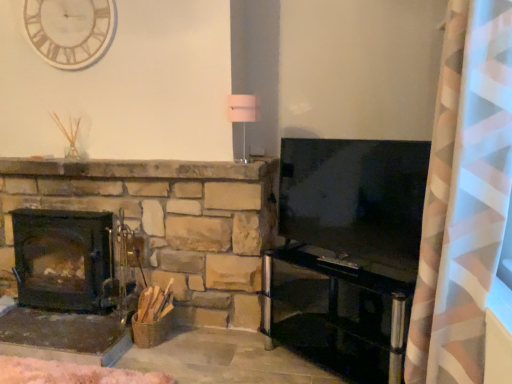
Question: Can you confirm if white wooden clock at upper left is wider than transparent glass entertainment center at lower right?

Choices:
 (A) no
 (B) yes

Answer: (A)

Question: Is white wooden clock at upper left outside transparent glass entertainment center at lower right?

Choices:
 (A) no
 (B) yes

Answer: (B)

Question: Is white wooden clock at upper left to the left of transparent glass entertainment center at lower right from the viewer's perspective?

Choices:
 (A) no
 (B) yes

Answer: (B)

Question: Could you tell me if white wooden clock at upper left is facing transparent glass entertainment center at lower right?

Choices:
 (A) no
 (B) yes

Answer: (A)

Question: Is white wooden clock at upper left positioned with its back to transparent glass entertainment center at lower right?

Choices:
 (A) no
 (B) yes

Answer: (A)

Question: Is the depth of white wooden clock at upper left greater than that of transparent glass entertainment center at lower right?

Choices:
 (A) yes
 (B) no

Answer: (A)

Question: From a real-world perspective, does transparent glass entertainment center at lower right sit lower than pink/white striped curtain at right?

Choices:
 (A) yes
 (B) no

Answer: (A)

Question: Can you confirm if transparent glass entertainment center at lower right is positioned to the left of pink/white striped curtain at right?

Choices:
 (A) no
 (B) yes

Answer: (B)

Question: Can you confirm if transparent glass entertainment center at lower right is wider than pink/white striped curtain at right?

Choices:
 (A) no
 (B) yes

Answer: (A)

Question: Is transparent glass entertainment center at lower right smaller than pink/white striped curtain at right?

Choices:
 (A) yes
 (B) no

Answer: (A)

Question: Is transparent glass entertainment center at lower right taller than pink/white striped curtain at right?

Choices:
 (A) yes
 (B) no

Answer: (B)

Question: Are transparent glass entertainment center at lower right and pink/white striped curtain at right located far from each other?

Choices:
 (A) yes
 (B) no

Answer: (A)

Question: Considering the relative sizes of white wooden clock at upper left and flat-screen tv at right in the image provided, is white wooden clock at upper left thinner than flat-screen tv at right?

Choices:
 (A) yes
 (B) no

Answer: (A)